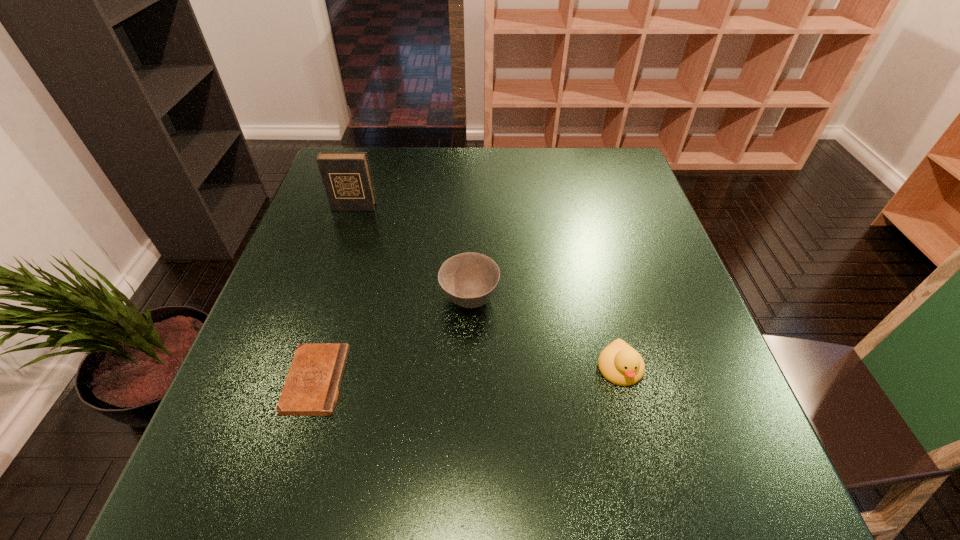
Locate an element on the screen. free space between the second farthest object and the rightmost object is located at coordinates (544, 334).

Find the location of a particular element. Image resolution: width=960 pixels, height=540 pixels. vacant space in between the rightmost object and the third object from left to right is located at coordinates (544, 334).

This screenshot has height=540, width=960. I want to click on empty location between the duckling and the bowl, so click(544, 334).

Identify the location of free space between the shortest object and the farther diary. (335, 294).

Identify the location of vacant space that is in between the taller diary and the bowl. This screenshot has height=540, width=960. (412, 253).

You are a GUI agent. You are given a task and a screenshot of the screen. Output one action in this format:
    pyautogui.click(x=<x>, y=<y>)
    Task: Click on the free space between the duckling and the shortest object
    The width and height of the screenshot is (960, 540).
    Given the screenshot: What is the action you would take?
    pos(468,375)

Locate an element on the screen. the closest object to the nearer diary is located at coordinates (469, 280).

The image size is (960, 540). I want to click on the third closest object to the second object from right to left, so click(x=346, y=176).

This screenshot has height=540, width=960. Identify the location of free spot that satisfies the following two spatial constraints: 1. on the front cover of the third object from left to right; 2. on the right side of the taller diary. (324, 298).

The width and height of the screenshot is (960, 540). What are the coordinates of `vacant space that satisfies the following two spatial constraints: 1. on the front side of the second object from right to left; 2. on the spine side of the nearer diary` in the screenshot? It's located at (468, 380).